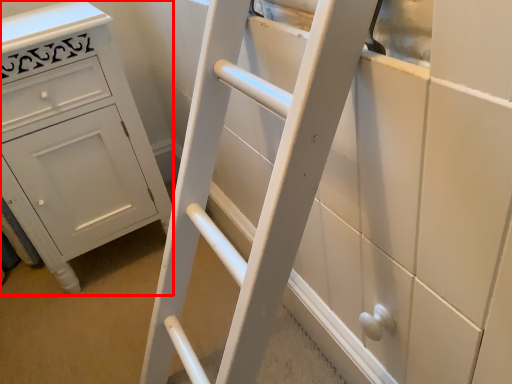
Question: From the image's perspective, where is chest of drawers (annotated by the red box) located relative to ladder?

Choices:
 (A) above
 (B) below

Answer: (A)